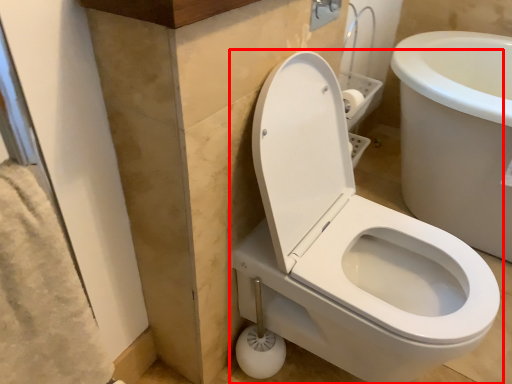
Question: In this image, where is toilet (annotated by the red box) located relative to shower?

Choices:
 (A) right
 (B) left

Answer: (A)